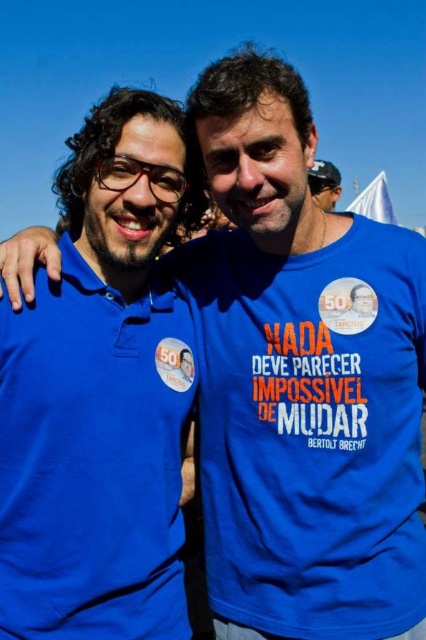
Question: Estimate the real-world distances between objects in this image. Which object is closer to the matte blue t-shirt at center?

Choices:
 (A) matte blue polo shirt at left
 (B) matte blue shirt at center

Answer: (A)

Question: Is the position of matte blue t-shirt at center more distant than that of matte blue polo shirt at left?

Choices:
 (A) no
 (B) yes

Answer: (B)

Question: Which object is farther from the camera taking this photo?

Choices:
 (A) matte blue shirt at center
 (B) matte blue t-shirt at center

Answer: (A)

Question: Which is nearer to the matte blue t-shirt at center?

Choices:
 (A) matte blue polo shirt at left
 (B) matte blue shirt at center

Answer: (A)

Question: Can you confirm if matte blue polo shirt at left is positioned below matte blue shirt at center?

Choices:
 (A) no
 (B) yes

Answer: (B)

Question: Can you confirm if matte blue t-shirt at center is bigger than matte blue polo shirt at left?

Choices:
 (A) no
 (B) yes

Answer: (A)